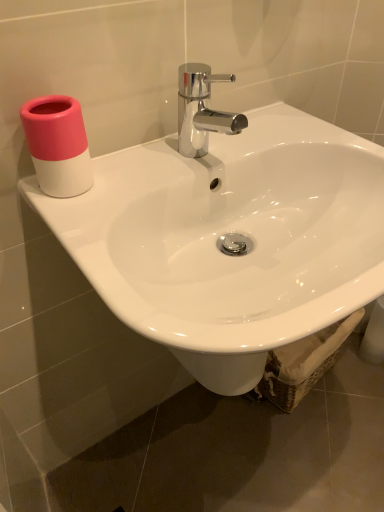
The height and width of the screenshot is (512, 384). Identify the location of white glossy sink at upper center. (231, 231).

The image size is (384, 512). What do you see at coordinates (231, 231) in the screenshot? I see `white glossy sink at upper center` at bounding box center [231, 231].

Describe the element at coordinates (58, 145) in the screenshot. I see `pink matte cup at upper left` at that location.

In order to click on pink matte cup at upper left in this screenshot , I will do `click(58, 145)`.

Locate an element on the screen. white glossy sink at upper center is located at coordinates (231, 231).

Between white glossy sink at upper center and pink matte cup at upper left, which one appears on the right side from the viewer's perspective?

white glossy sink at upper center is more to the right.

Considering the positions of objects white glossy sink at upper center and pink matte cup at upper left in the image provided, who is behind, white glossy sink at upper center or pink matte cup at upper left?

pink matte cup at upper left is further away from the camera.

Considering the points (222, 218) and (52, 172), which point is behind, point (222, 218) or point (52, 172)?

The point (222, 218) is behind.

From the image's perspective, which object appears higher, white glossy sink at upper center or pink matte cup at upper left?

pink matte cup at upper left.

From a real-world perspective, which object rests below the other?

white glossy sink at upper center is physically lower.

Is white glossy sink at upper center wider than pink matte cup at upper left?

Indeed, white glossy sink at upper center has a greater width compared to pink matte cup at upper left.

Is white glossy sink at upper center shorter than pink matte cup at upper left?

In fact, white glossy sink at upper center may be taller than pink matte cup at upper left.

Between white glossy sink at upper center and pink matte cup at upper left, which one has smaller size?

pink matte cup at upper left.

Is white glossy sink at upper center outside of pink matte cup at upper left?

Yes, white glossy sink at upper center is not within pink matte cup at upper left.

Is white glossy sink at upper center next to pink matte cup at upper left and touching it?

No, white glossy sink at upper center is not in contact with pink matte cup at upper left.

Does white glossy sink at upper center turn towards pink matte cup at upper left?

No.

Can you tell me how much white glossy sink at upper center and pink matte cup at upper left differ in facing direction?

There is a 1.36-degree angle between the facing directions of white glossy sink at upper center and pink matte cup at upper left.

How much distance is there between white glossy sink at upper center and pink matte cup at upper left?

The distance of white glossy sink at upper center from pink matte cup at upper left is 23.21 centimeters.

You are a GUI agent. You are given a task and a screenshot of the screen. Output one action in this format:
    pyautogui.click(x=<x>, y=<y>)
    Task: Click on the toiletry above the white glossy sink at upper center (from the image's perspective)
    The width and height of the screenshot is (384, 512).
    Given the screenshot: What is the action you would take?
    pyautogui.click(x=58, y=145)

Which object is positioned more to the left, pink matte cup at upper left or white glossy sink at upper center?

From the viewer's perspective, pink matte cup at upper left appears more on the left side.

Is pink matte cup at upper left behind white glossy sink at upper center?

Yes, it is.

Is point (84, 150) less distant than point (154, 172)?

Yes, it is in front of point (154, 172).

From the image's perspective, relative to white glossy sink at upper center, is pink matte cup at upper left above or below?

Based on their image positions, pink matte cup at upper left is located above white glossy sink at upper center.

From a real-world perspective, is pink matte cup at upper left under white glossy sink at upper center?

Incorrect, from a real-world perspective, pink matte cup at upper left is higher than white glossy sink at upper center.

Considering the sizes of objects pink matte cup at upper left and white glossy sink at upper center in the image provided, who is wider, pink matte cup at upper left or white glossy sink at upper center?

white glossy sink at upper center.

Is pink matte cup at upper left taller than white glossy sink at upper center?

No, pink matte cup at upper left is not taller than white glossy sink at upper center.

In terms of size, does pink matte cup at upper left appear bigger or smaller than white glossy sink at upper center?

Clearly, pink matte cup at upper left is smaller in size than white glossy sink at upper center.

Do you think pink matte cup at upper left is within white glossy sink at upper center, or outside of it?

pink matte cup at upper left is not inside white glossy sink at upper center, it's outside.

Is there a large distance between pink matte cup at upper left and white glossy sink at upper center?

No.

Consider the image. Is pink matte cup at upper left oriented towards white glossy sink at upper center?

No, pink matte cup at upper left does not turn towards white glossy sink at upper center.

Looking at this image, what's the angular difference between pink matte cup at upper left and white glossy sink at upper center's facing directions?

The angular difference between pink matte cup at upper left and white glossy sink at upper center is 1.36 degrees.

Locate an element on the screen. sink on the right of pink matte cup at upper left is located at coordinates coord(231,231).

Where is `toiletry above the white glossy sink at upper center (from the image's perspective)`? Image resolution: width=384 pixels, height=512 pixels. toiletry above the white glossy sink at upper center (from the image's perspective) is located at coordinates (58, 145).

Where is `toiletry that appears above the white glossy sink at upper center (from a real-world perspective)`? This screenshot has height=512, width=384. toiletry that appears above the white glossy sink at upper center (from a real-world perspective) is located at coordinates (58, 145).